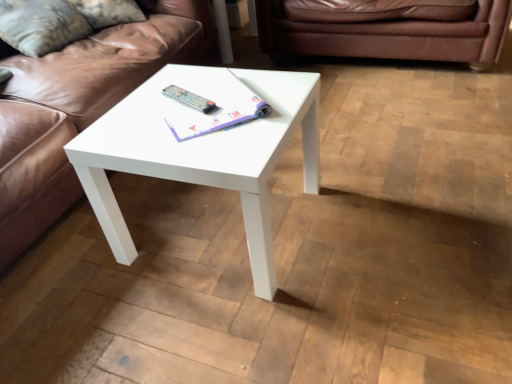
Locate an element on the screen. Image resolution: width=512 pixels, height=384 pixels. free location in front of white glossy coffee table at center is located at coordinates (238, 329).